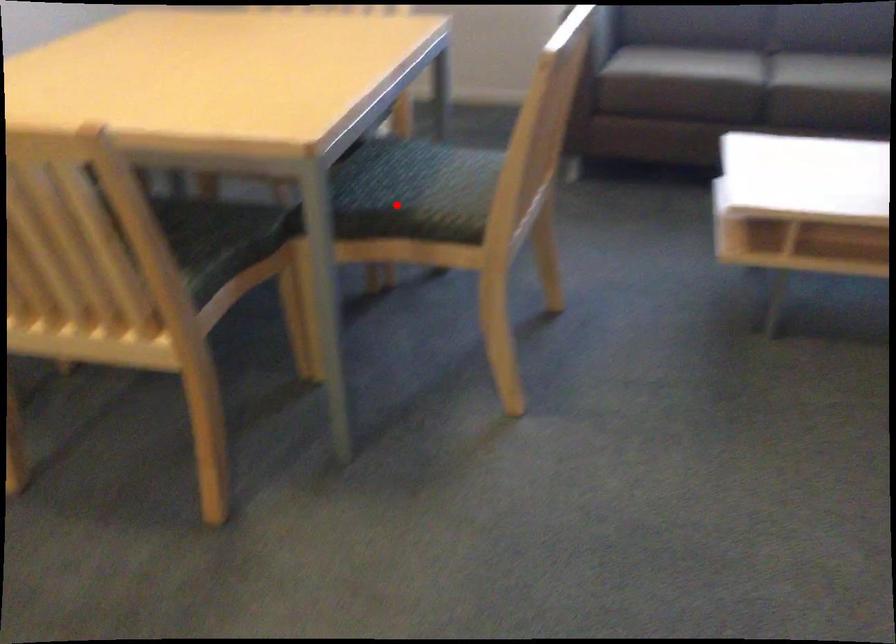
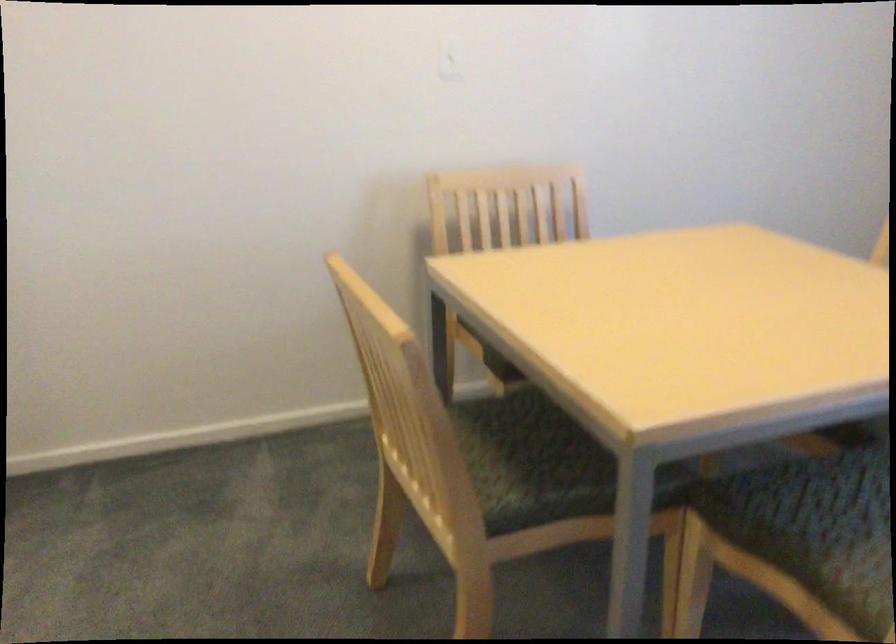
Locate, in the second image, the point that corresponds to the highlighted location in the first image.

(798, 541)